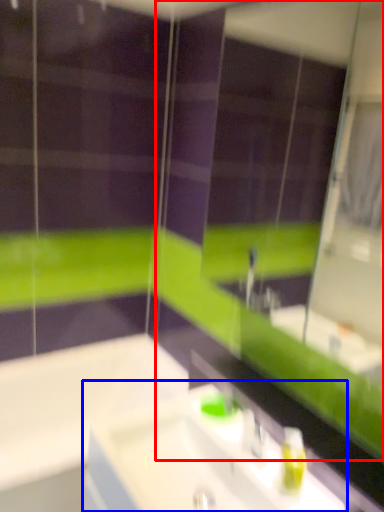
Question: Which object appears closest to the camera in this image, mirror (highlighted by a red box) or sink (highlighted by a blue box)?

Choices:
 (A) mirror
 (B) sink

Answer: (A)